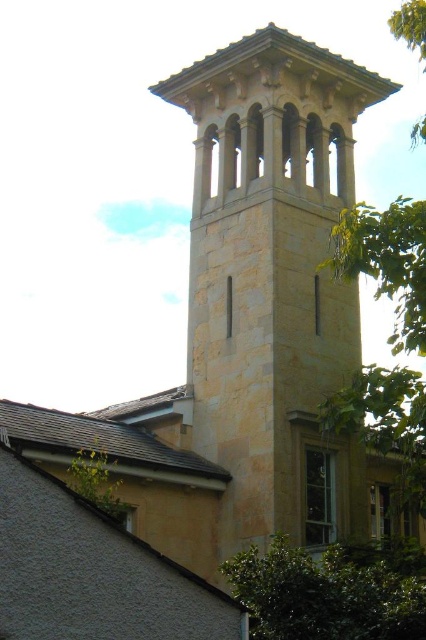
Question: Which object is the closest to the green leafy tree at upper left?

Choices:
 (A) green leafy tree at lower right
 (B) beige stone church tower at upper center

Answer: (A)

Question: Does beige stone church tower at upper center appear on the left side of green leafy tree at lower right?

Choices:
 (A) yes
 (B) no

Answer: (A)

Question: Is beige stone church tower at upper center positioned behind green leafy tree at lower right?

Choices:
 (A) no
 (B) yes

Answer: (B)

Question: Estimate the real-world distances between objects in this image. Which object is closer to the green leafy tree at upper left?

Choices:
 (A) green leafy tree at lower right
 (B) beige stone church tower at upper center

Answer: (A)

Question: Based on their relative distances, which object is farther from the beige stone church tower at upper center?

Choices:
 (A) green leafy tree at upper left
 (B) green leafy tree at lower right

Answer: (A)

Question: Is the position of beige stone church tower at upper center less distant than that of green leafy tree at lower right?

Choices:
 (A) no
 (B) yes

Answer: (A)